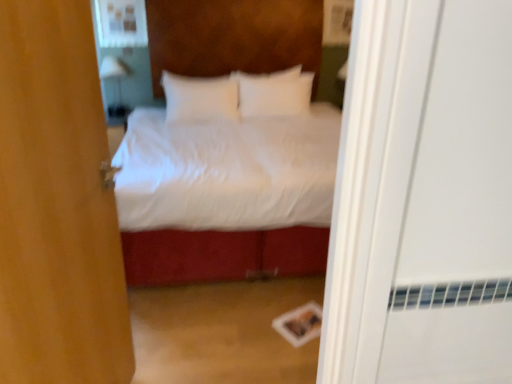
Question: Which direction should I rotate to look at white soft pillow at center, the first pillow viewed from the right?

Choices:
 (A) left
 (B) right

Answer: (B)

Question: Is white glossy lamp at upper left further to the viewer compared to white soft pillow at center, positioned as the second pillow in left-to-right order?

Choices:
 (A) yes
 (B) no

Answer: (A)

Question: Is white glossy lamp at upper left surrounding white soft pillow at center, positioned as the second pillow in left-to-right order?

Choices:
 (A) no
 (B) yes

Answer: (A)

Question: Does white glossy lamp at upper left appear on the right side of white soft pillow at center, the first pillow viewed from the right?

Choices:
 (A) no
 (B) yes

Answer: (A)

Question: Is white glossy lamp at upper left facing towards white soft pillow at center, the first pillow viewed from the right?

Choices:
 (A) yes
 (B) no

Answer: (B)

Question: Is white glossy lamp at upper left positioned with its back to white soft pillow at center, the first pillow viewed from the right?

Choices:
 (A) yes
 (B) no

Answer: (B)

Question: From the image's perspective, does white glossy lamp at upper left appear higher than white soft pillow at center, the first pillow viewed from the right?

Choices:
 (A) yes
 (B) no

Answer: (B)

Question: Is white soft pillow at center, the first pillow viewed from the right, bigger than matte white medicine cabinet at upper left?

Choices:
 (A) no
 (B) yes

Answer: (B)

Question: Is white soft pillow at center, positioned as the second pillow in left-to-right order, taller than matte white medicine cabinet at upper left?

Choices:
 (A) yes
 (B) no

Answer: (A)

Question: Would you say white soft pillow at center, the first pillow viewed from the right, contains matte white medicine cabinet at upper left?

Choices:
 (A) no
 (B) yes

Answer: (A)

Question: From the image's perspective, is white soft pillow at center, the first pillow viewed from the right, below matte white medicine cabinet at upper left?

Choices:
 (A) yes
 (B) no

Answer: (A)

Question: Is there a large distance between white soft pillow at center, the first pillow viewed from the right, and matte white medicine cabinet at upper left?

Choices:
 (A) no
 (B) yes

Answer: (B)

Question: From a real-world perspective, is white soft pillow at center, the first pillow viewed from the right, under matte white medicine cabinet at upper left?

Choices:
 (A) yes
 (B) no

Answer: (A)

Question: Is brown fabric door at center positioned before matte white medicine cabinet at upper left?

Choices:
 (A) yes
 (B) no

Answer: (A)